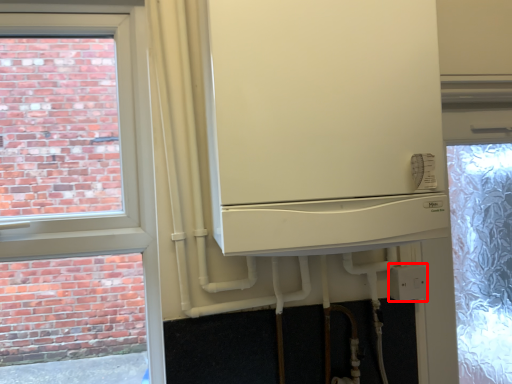
Question: From the image's perspective, where is electric outlet (annotated by the red box) located in relation to fridge in the image?

Choices:
 (A) below
 (B) above

Answer: (A)